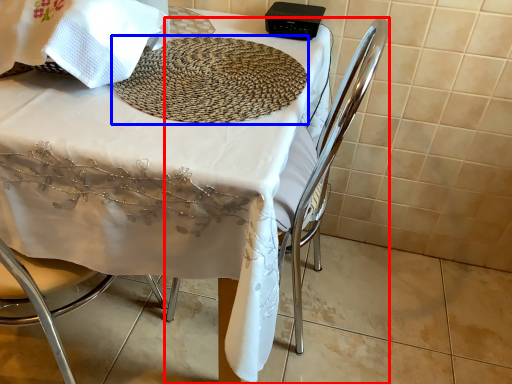
Question: Which point is further to the camera, chair (highlighted by a red box) or mat (highlighted by a blue box)?

Choices:
 (A) chair
 (B) mat

Answer: (B)